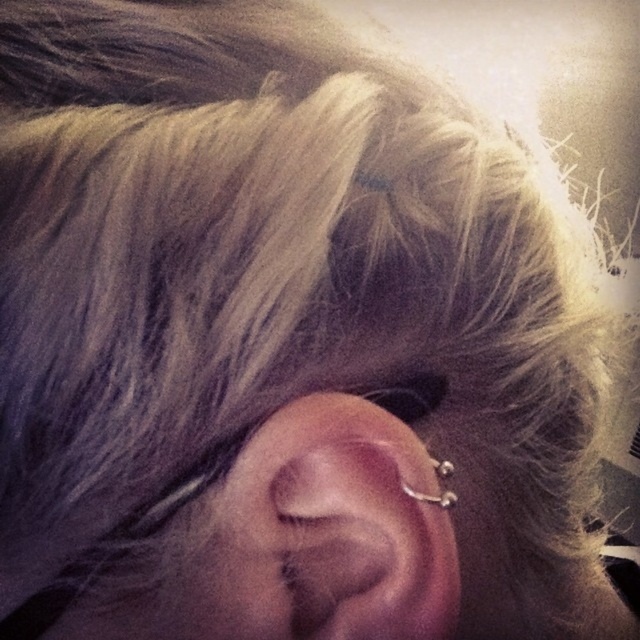
Between silver metallic ear at center and silver metallic hoop at ear, which one appears on the right side from the viewer's perspective?

From the viewer's perspective, silver metallic hoop at ear appears more on the right side.

At what (x,y) coordinates should I click in order to perform the action: click on silver metallic ear at center. Please return your answer as a coordinate pair (x, y). Looking at the image, I should click on (332, 531).